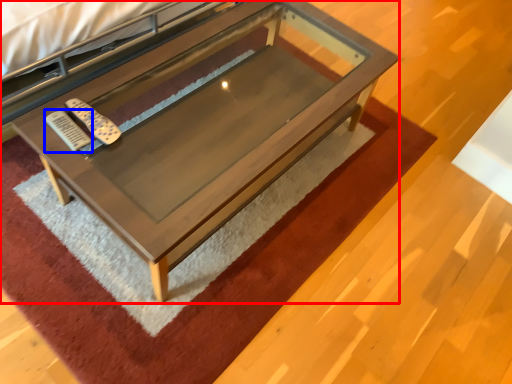
Question: Among these objects, which one is farthest to the camera, table (highlighted by a red box) or remote (highlighted by a blue box)?

Choices:
 (A) table
 (B) remote

Answer: (B)